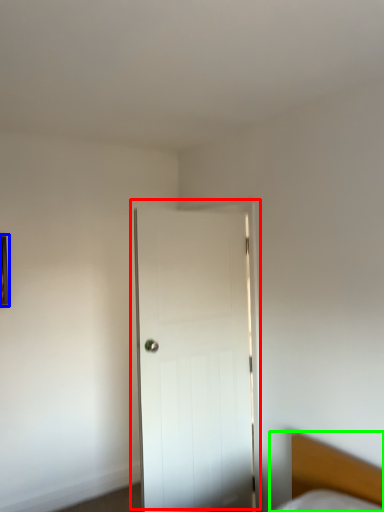
Question: Estimate the real-world distances between objects in this image. Which object is closer to door (highlighted by a red box), picture frame (highlighted by a blue box) or bed (highlighted by a green box)?

Choices:
 (A) picture frame
 (B) bed

Answer: (B)